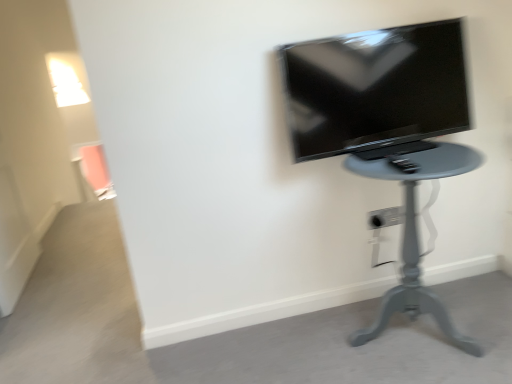
Question: Considering the relative sizes of matte gray table at center and white plastic electric outlet at lower center in the image provided, is matte gray table at center thinner than white plastic electric outlet at lower center?

Choices:
 (A) no
 (B) yes

Answer: (A)

Question: From the image's perspective, would you say matte gray table at center is positioned over white plastic electric outlet at lower center?

Choices:
 (A) yes
 (B) no

Answer: (B)

Question: Would you consider matte gray table at center to be distant from white plastic electric outlet at lower center?

Choices:
 (A) yes
 (B) no

Answer: (B)

Question: Is white plastic electric outlet at lower center at the back of matte gray table at center?

Choices:
 (A) yes
 (B) no

Answer: (A)

Question: Does matte gray table at center have a smaller size compared to white plastic electric outlet at lower center?

Choices:
 (A) no
 (B) yes

Answer: (A)

Question: From the image's perspective, is matte gray table at center under white plastic electric outlet at lower center?

Choices:
 (A) yes
 (B) no

Answer: (A)

Question: Would you consider matte black tv at upper right to be distant from matte gray table at center?

Choices:
 (A) yes
 (B) no

Answer: (B)

Question: Considering the relative positions of matte black tv at upper right and matte gray table at center in the image provided, is matte black tv at upper right to the left of matte gray table at center from the viewer's perspective?

Choices:
 (A) yes
 (B) no

Answer: (A)

Question: Is matte black tv at upper right next to matte gray table at center and touching it?

Choices:
 (A) no
 (B) yes

Answer: (A)

Question: Is matte black tv at upper right shorter than matte gray table at center?

Choices:
 (A) yes
 (B) no

Answer: (A)

Question: Is matte black tv at upper right closer to the viewer compared to matte gray table at center?

Choices:
 (A) yes
 (B) no

Answer: (B)

Question: From a real-world perspective, is matte black tv at upper right located beneath matte gray table at center?

Choices:
 (A) no
 (B) yes

Answer: (A)

Question: Is white plastic electric outlet at lower center with matte black tv at upper right?

Choices:
 (A) yes
 (B) no

Answer: (B)